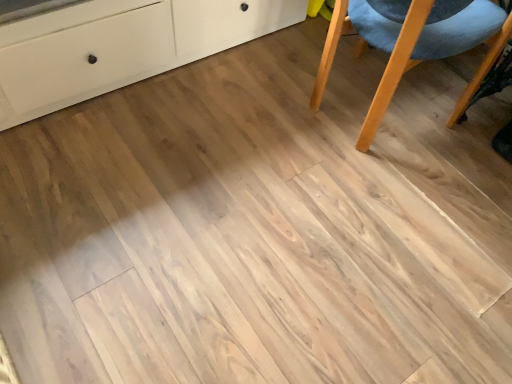
Question: From the image's perspective, is matte white cabinet at upper left located beneath light wood chair at right?

Choices:
 (A) no
 (B) yes

Answer: (A)

Question: Considering the relative sizes of matte white cabinet at upper left and light wood chair at right in the image provided, is matte white cabinet at upper left bigger than light wood chair at right?

Choices:
 (A) yes
 (B) no

Answer: (A)

Question: Are matte white cabinet at upper left and light wood chair at right far apart?

Choices:
 (A) yes
 (B) no

Answer: (B)

Question: From a real-world perspective, is matte white cabinet at upper left over light wood chair at right?

Choices:
 (A) yes
 (B) no

Answer: (B)

Question: Is matte white cabinet at upper left taller than light wood chair at right?

Choices:
 (A) yes
 (B) no

Answer: (B)

Question: Could you tell me if matte white cabinet at upper left is turned towards light wood chair at right?

Choices:
 (A) no
 (B) yes

Answer: (B)

Question: From the image's perspective, is light wood chair at right located beneath matte white cabinet at upper left?

Choices:
 (A) yes
 (B) no

Answer: (A)

Question: Is light wood chair at right positioned behind matte white cabinet at upper left?

Choices:
 (A) yes
 (B) no

Answer: (A)

Question: Can you confirm if light wood chair at right is thinner than matte white cabinet at upper left?

Choices:
 (A) yes
 (B) no

Answer: (A)

Question: Is light wood chair at right wider than matte white cabinet at upper left?

Choices:
 (A) yes
 (B) no

Answer: (B)

Question: Would you say light wood chair at right contains matte white cabinet at upper left?

Choices:
 (A) no
 (B) yes

Answer: (A)

Question: From a real-world perspective, is light wood chair at right under matte white cabinet at upper left?

Choices:
 (A) no
 (B) yes

Answer: (A)

Question: From a real-world perspective, relative to matte white cabinet at upper left, is light wood chair at right vertically above or below?

Choices:
 (A) below
 (B) above

Answer: (B)